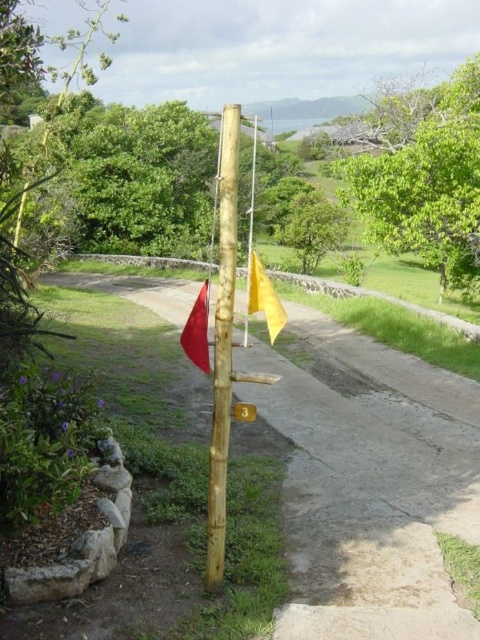
You are a park visitor holding a measuring tape. You want to know if the natural wood pole at center is wider than the yellow matte flag at center. Can you determine this without measuring them directly?

The natural wood pole at center has a larger width than the yellow matte flag at center according to the description.

You are standing at the point marked by the plaque with the number 3 on the bamboo pole on the left side of the pathway. You want to walk to the point marked by the coordinates point at (267, 317). The path curves gently to the right. How far will you have to walk along the path to reach your destination?

The distance between the plaque on the bamboo pole and the point at (267, 317) is 3.44 meters, so you will have to walk 3.44 meters along the path to reach your destination.